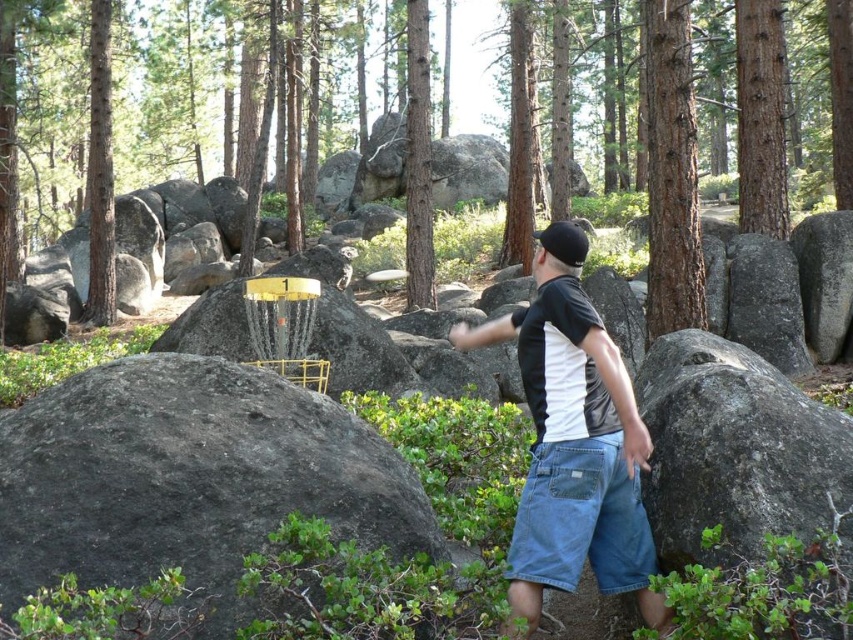
Question: Can you confirm if brown rough bark tree at upper right is positioned to the right of black matte baseball hat at center?

Choices:
 (A) no
 (B) yes

Answer: (B)

Question: Is green textured tree at center bigger than black matte baseball hat at center?

Choices:
 (A) yes
 (B) no

Answer: (A)

Question: Does brown rough bark tree at upper right appear under black matte baseball hat at center?

Choices:
 (A) yes
 (B) no

Answer: (B)

Question: Which object is positioned closest to the black cotton t-shirt at center?

Choices:
 (A) gray rock at center
 (B) black matte baseball hat at center
 (C) brown rough bark tree at upper right
 (D) brown rough bark tree at right

Answer: (B)

Question: Which of the following is the farthest from the observer?

Choices:
 (A) brown rough bark tree at right
 (B) black matte baseball hat at center
 (C) gray rock at center
 (D) smooth brown tree trunk at left

Answer: (D)

Question: Which point is closer to the camera?

Choices:
 (A) black cotton t-shirt at center
 (B) brown rough bark tree at upper right
 (C) green textured tree at center
 (D) gray rock at center

Answer: (D)